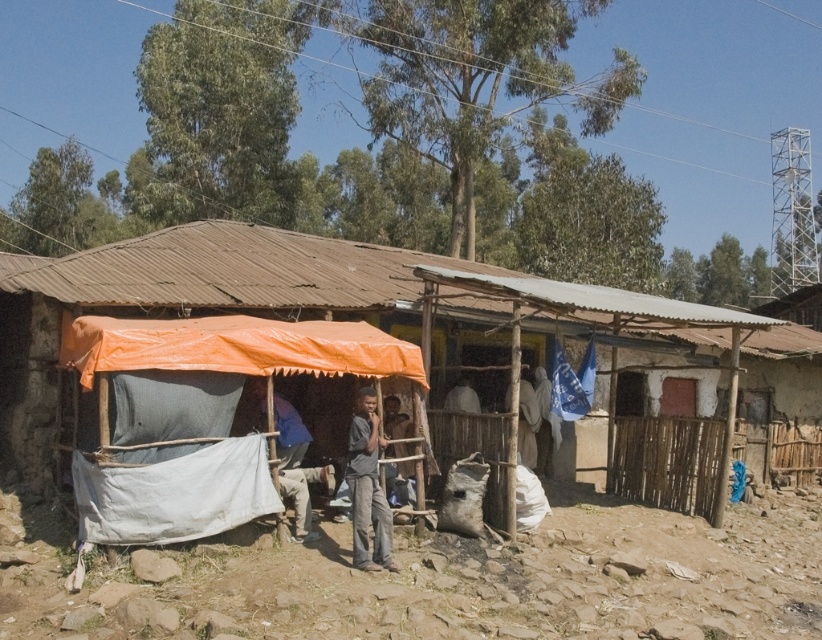
You are a delivery person who needs to place a package between the blue fabric at center and the dark gray fabric at center. The package requires 10 feet of space. Is there enough space between them?

The blue fabric at center is 10.26 feet from dark gray fabric at center, so yes, there is enough space between them to place the package since the distance is greater than the required 10 feet.